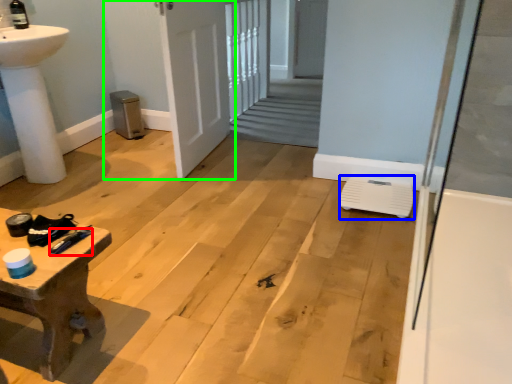
Question: Which object is positioned closest to tool (highlighted by a red box)? Select from water heater (highlighted by a blue box) and door (highlighted by a green box).

Choices:
 (A) water heater
 (B) door

Answer: (A)